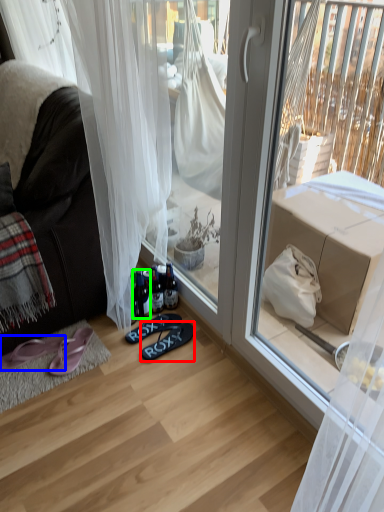
Question: Which object is the closest to the footwear (highlighted by a red box)? Choose among these: footwear (highlighted by a blue box) or bottle (highlighted by a green box).

Choices:
 (A) footwear
 (B) bottle

Answer: (B)